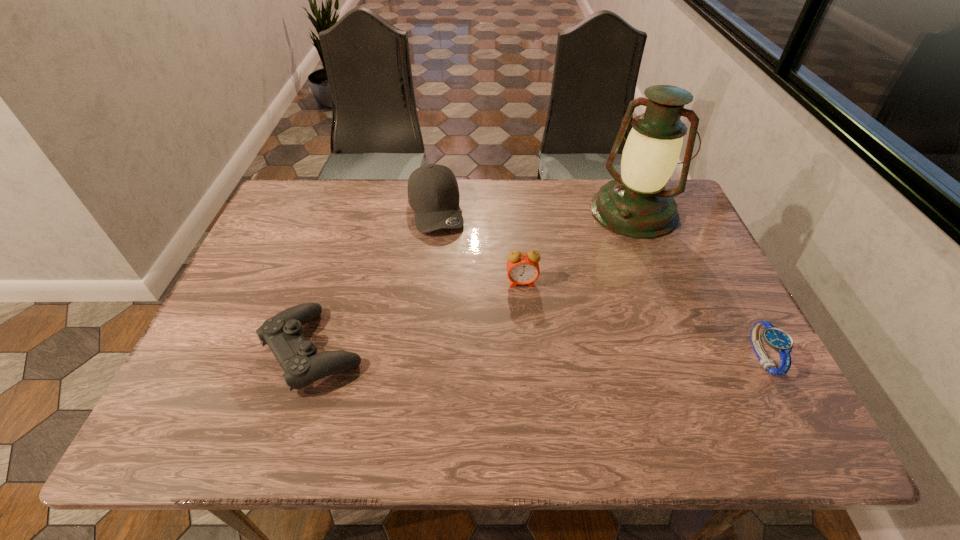
I want to click on free space between the tallest object and the third object from right to left, so click(578, 247).

Locate an element on the screen. This screenshot has height=540, width=960. object that is the fourth closest to the second object from left to right is located at coordinates (777, 339).

Select which object appears as the closest to the fourth object from right to left. Please provide its 2D coordinates. Your answer should be formatted as a tuple, i.e. [(x, y)], where the tuple contains the x and y coordinates of a point satisfying the conditions above.

[(522, 268)]

The height and width of the screenshot is (540, 960). In order to click on vacant space that satisfies the following two spatial constraints: 1. on the front side of the baseball cap; 2. on the left side of the third nearest object in this screenshot , I will do (427, 282).

The width and height of the screenshot is (960, 540). What are the coordinates of `vacant point that satisfies the following two spatial constraints: 1. on the back side of the control; 2. on the left side of the second object from left to right` in the screenshot? It's located at (358, 210).